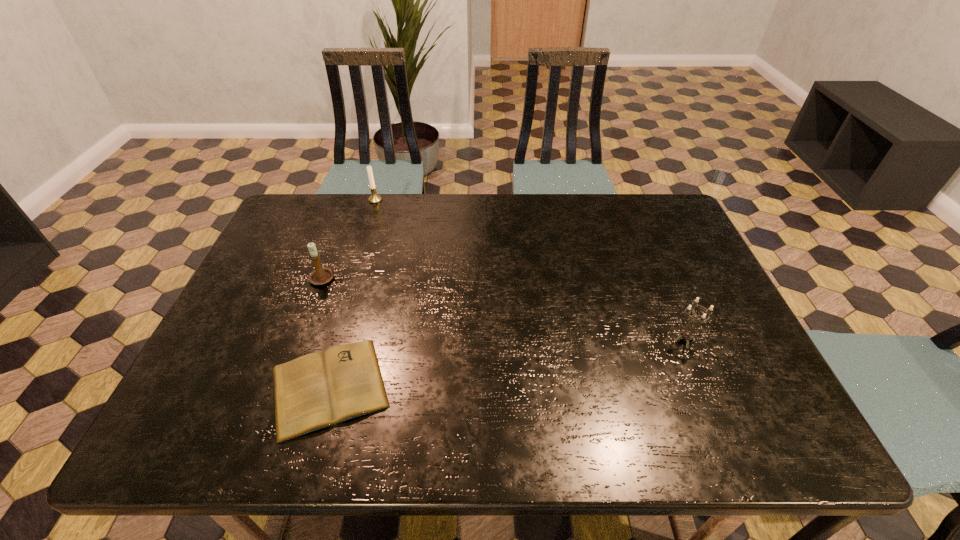
Find the location of a particular element. This screenshot has height=540, width=960. the farthest object is located at coordinates (375, 198).

Locate an element on the screen. The width and height of the screenshot is (960, 540). the second candle holder from left to right is located at coordinates (375, 198).

Locate an element on the screen. The width and height of the screenshot is (960, 540). the leftmost candle holder is located at coordinates (320, 276).

I want to click on the second nearest candle holder, so click(x=320, y=276).

I want to click on the rightmost candle holder, so click(685, 335).

You are a GUI agent. You are given a task and a screenshot of the screen. Output one action in this format:
    pyautogui.click(x=<x>, y=<y>)
    Task: Click on the rightmost object
    
    Given the screenshot: What is the action you would take?
    (685, 335)

What are the coordinates of `the shortest object` in the screenshot? It's located at (317, 390).

This screenshot has height=540, width=960. In order to click on free space located 0.320m on the right of the farthest candle holder in this screenshot , I will do `click(477, 200)`.

Identify the location of free space located 0.250m on the side of the leftmost candle holder with the handle. This screenshot has height=540, width=960. (432, 279).

Where is `free spot located on the back of the rightmost object`? This screenshot has height=540, width=960. free spot located on the back of the rightmost object is located at coordinates (642, 240).